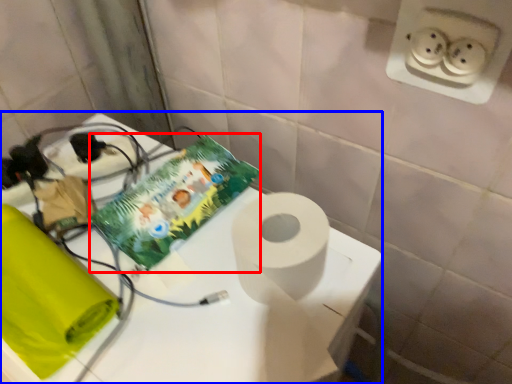
Question: Which object appears closest to the camera in this image, comic book (highlighted by a red box) or table (highlighted by a blue box)?

Choices:
 (A) comic book
 (B) table

Answer: (B)